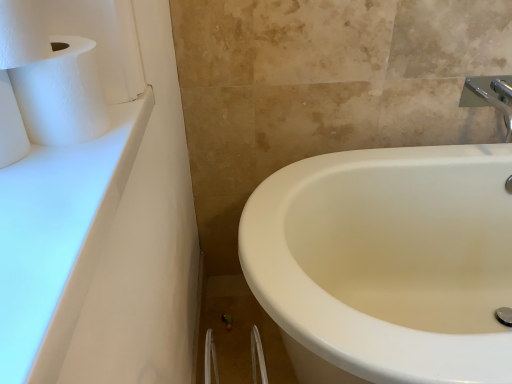
Question: From the image's perspective, is white matte toilet paper at left, which is the 2th toilet paper in top-to-bottom order, below silver metallic faucet at upper right?

Choices:
 (A) yes
 (B) no

Answer: (A)

Question: Does white matte toilet paper at left, the 1th toilet paper when ordered from bottom to top, have a lesser width compared to silver metallic faucet at upper right?

Choices:
 (A) yes
 (B) no

Answer: (A)

Question: Could you tell me if white matte toilet paper at left, the 1th toilet paper when ordered from bottom to top, is facing silver metallic faucet at upper right?

Choices:
 (A) yes
 (B) no

Answer: (B)

Question: Can you confirm if white matte toilet paper at left, which is the 2th toilet paper in top-to-bottom order, is positioned to the left of silver metallic faucet at upper right?

Choices:
 (A) no
 (B) yes

Answer: (B)

Question: Does white matte toilet paper at left, the 1th toilet paper when ordered from bottom to top, have a smaller size compared to silver metallic faucet at upper right?

Choices:
 (A) yes
 (B) no

Answer: (A)

Question: Is white matte toilet paper at left, the 1th toilet paper when ordered from bottom to top, touching silver metallic faucet at upper right?

Choices:
 (A) no
 (B) yes

Answer: (A)

Question: Considering the relative sizes of white matte toilet paper at left, the 1th toilet paper when ordered from bottom to top, and white textured toilet paper at upper left, the second toilet paper from the bottom, in the image provided, is white matte toilet paper at left, the 1th toilet paper when ordered from bottom to top, thinner than white textured toilet paper at upper left, the second toilet paper from the bottom,?

Choices:
 (A) yes
 (B) no

Answer: (B)

Question: Is white matte toilet paper at left, the 1th toilet paper when ordered from bottom to top, taller than white textured toilet paper at upper left, the 1th toilet paper from the top?

Choices:
 (A) yes
 (B) no

Answer: (A)

Question: Would you say white matte toilet paper at left, which is the 2th toilet paper in top-to-bottom order, contains white textured toilet paper at upper left, the 1th toilet paper from the top?

Choices:
 (A) yes
 (B) no

Answer: (B)

Question: Is white matte toilet paper at left, the 1th toilet paper when ordered from bottom to top, oriented away from white textured toilet paper at upper left, the second toilet paper from the bottom?

Choices:
 (A) yes
 (B) no

Answer: (B)

Question: Can you confirm if white matte toilet paper at left, the 1th toilet paper when ordered from bottom to top, is bigger than white textured toilet paper at upper left, the second toilet paper from the bottom?

Choices:
 (A) yes
 (B) no

Answer: (B)

Question: From a real-world perspective, is white matte toilet paper at left, the 1th toilet paper when ordered from bottom to top, positioned over white textured toilet paper at upper left, the second toilet paper from the bottom, based on gravity?

Choices:
 (A) no
 (B) yes

Answer: (A)

Question: Can you confirm if white textured toilet paper at upper left, the 1th toilet paper from the top, is positioned to the right of white matte toilet paper at left, the 1th toilet paper when ordered from bottom to top?

Choices:
 (A) yes
 (B) no

Answer: (A)